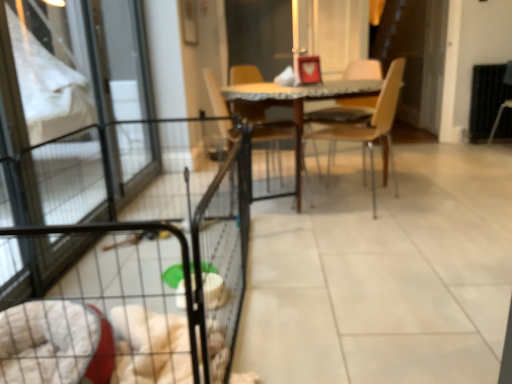
This screenshot has width=512, height=384. I want to click on vacant area that is in front of wooden chair at center, the first chair from the right, so click(361, 223).